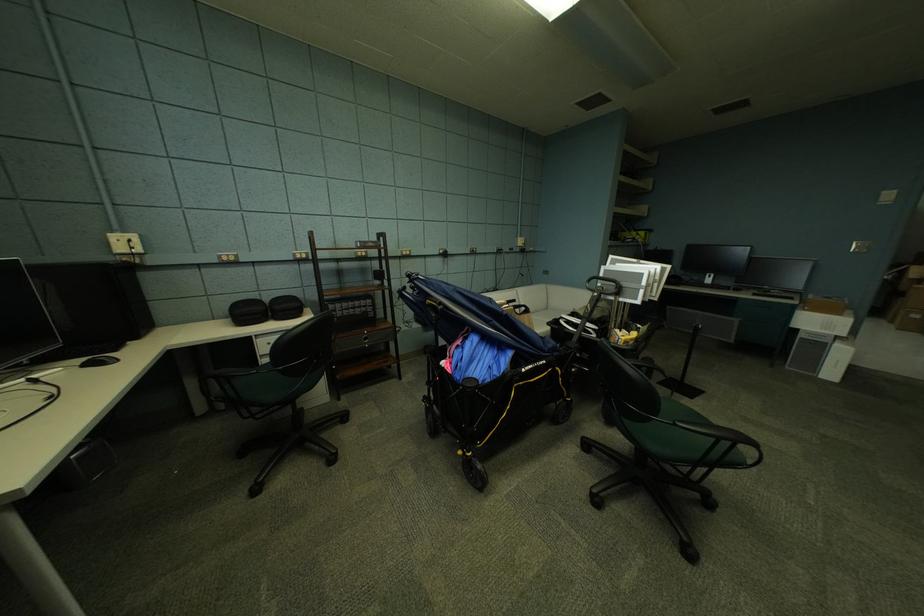
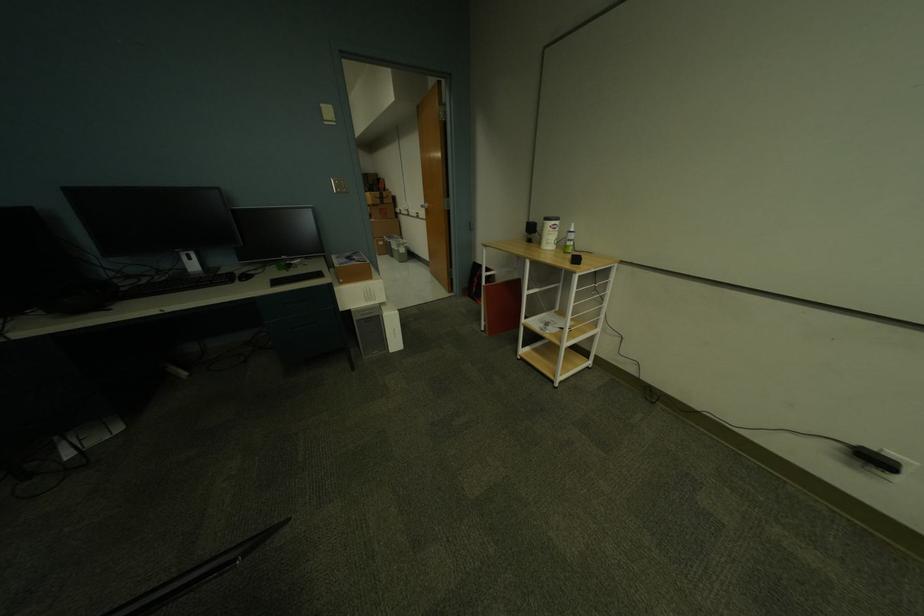
Find the pixel in the second image that matches [892,193] in the first image.

(331, 107)